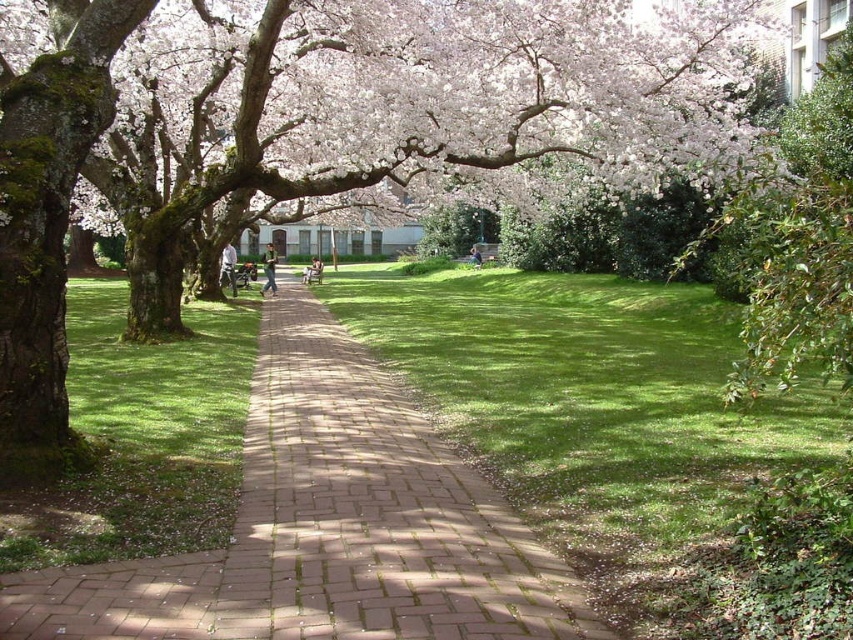
You are planning to set up a picnic blanket in the park. The picnic blanket is 2 meters wide. You see the green grass at center and the brick pavement at center. Which area can accommodate your picnic blanket?

The green grass at center is bigger than the brick pavement at center, so the picnic blanket can be placed on the green grass at center since it has enough space.

You are a gardener who wants to plant a new flower bed between the green mossy tree at center and the green grass at center. Since the tree is above the grass, where should you place the flower bed so it is visible from the ground level?

The flower bed should be placed on the green grass at center since the green mossy tree at center is above it, ensuring visibility from ground level.